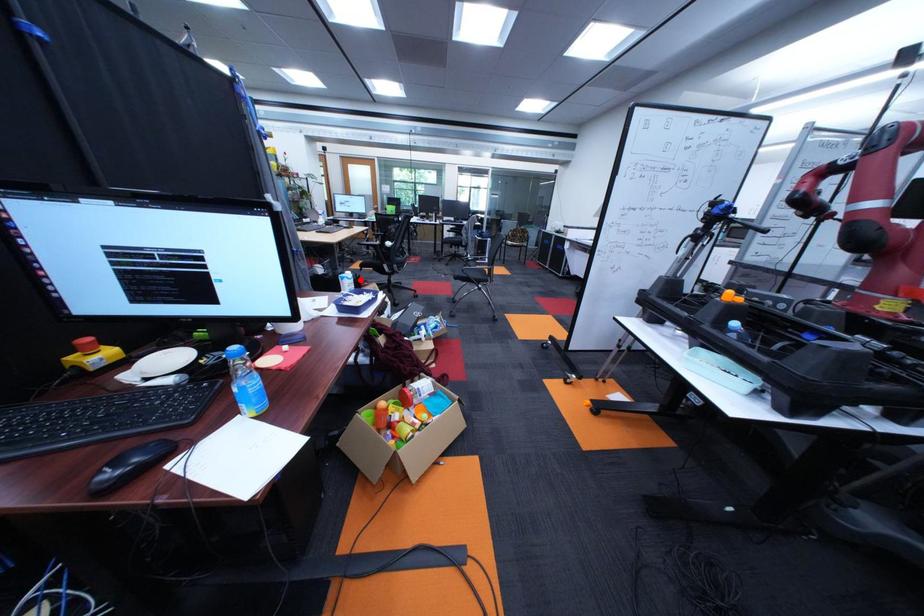
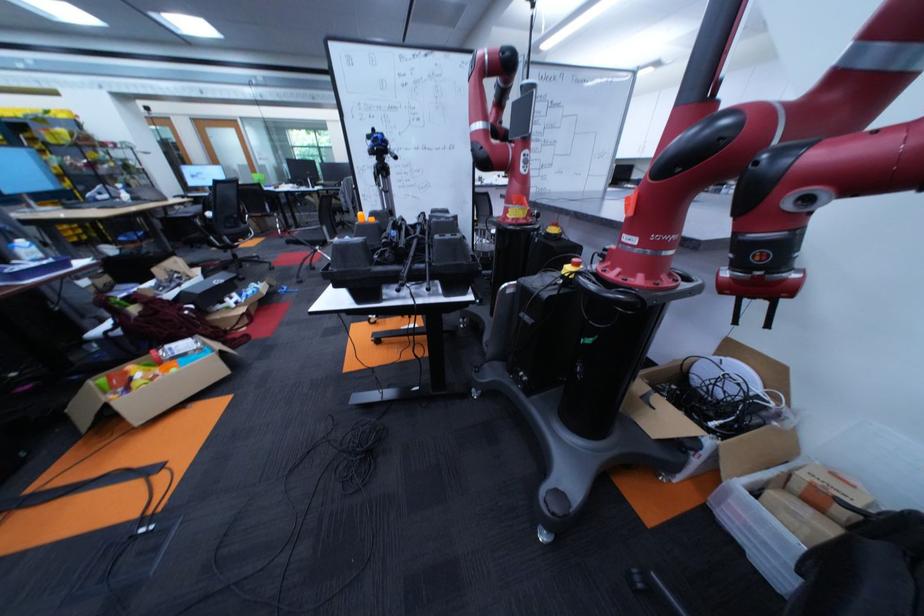
Question: I am providing you with two images of the same scene from different viewpoints. Image1 has a red point marked. In image2, the corresponding 3D location appears at what relative position? Reply with the corresponding letter.

Choices:
 (A) Closer
 (B) Farther

Answer: (B)